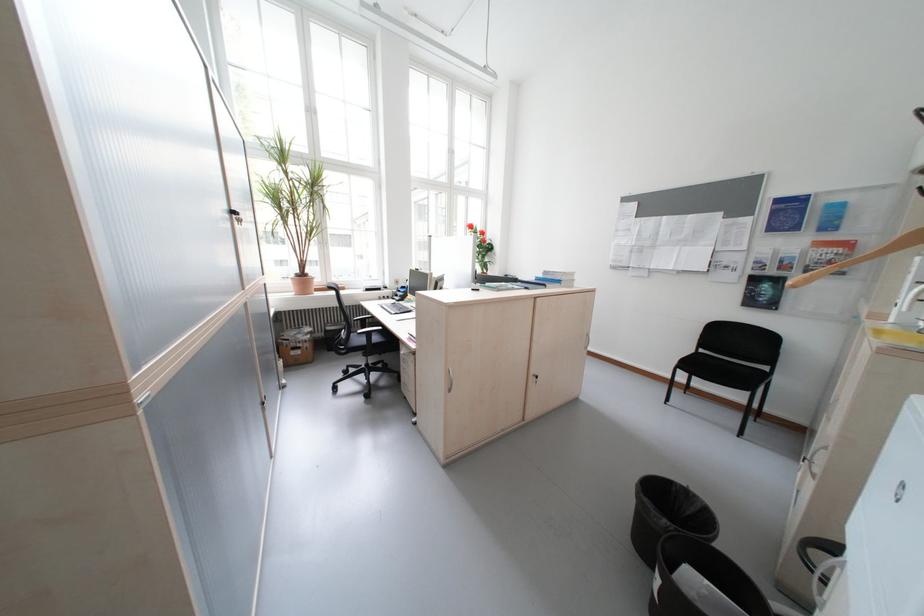
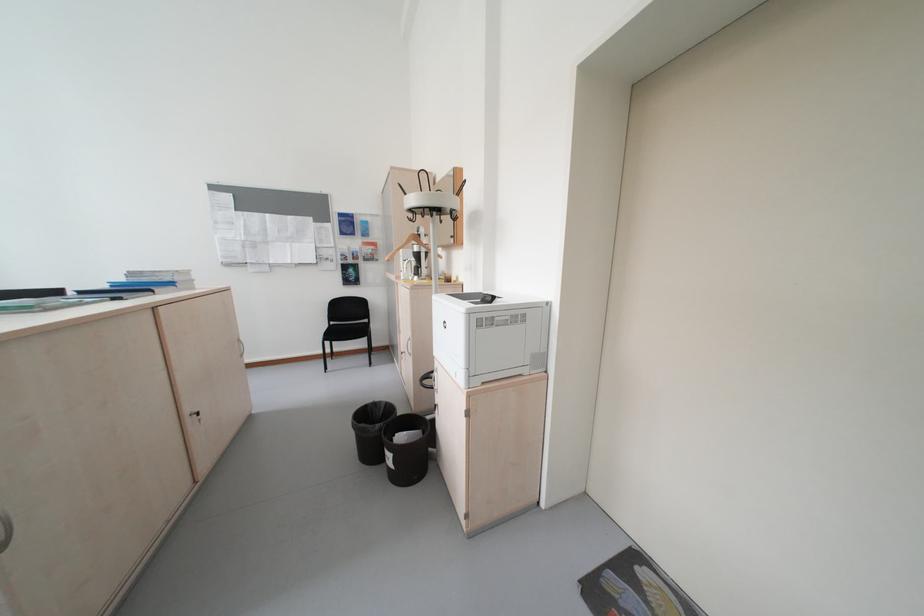
Question: The images are taken continuously from a first-person perspective. In which direction is your viewpoint rotating?

Choices:
 (A) Left
 (B) Right
 (C) Up
 (D) Down

Answer: (B)